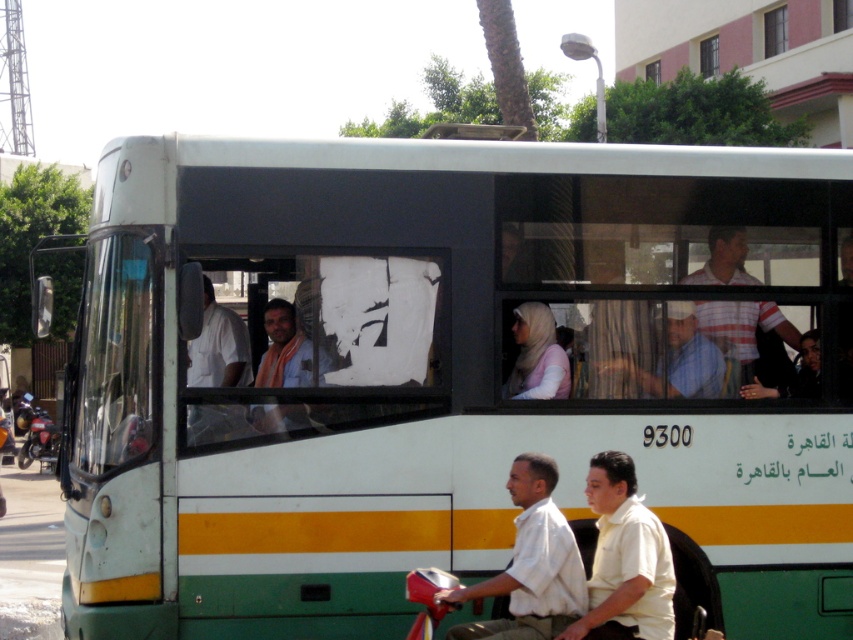
Measure the distance between point (590, 500) and camera.

Point (590, 500) and camera are 5.75 meters apart.

Find the location of a particular element. white matte shirt at center is located at coordinates (624, 560).

Between striped cotton shirt at center and shiny black motorcycle at left, which one appears on the left side from the viewer's perspective?

shiny black motorcycle at left is more to the left.

Describe the element at coordinates (747, 340) in the screenshot. I see `striped cotton shirt at center` at that location.

Image resolution: width=853 pixels, height=640 pixels. I want to click on striped cotton shirt at center, so click(747, 340).

Is white cotton shirt at center smaller than shiny black motorcycle at left?

Incorrect, white cotton shirt at center is not smaller in size than shiny black motorcycle at left.

Which is more to the left, white cotton shirt at center or shiny black motorcycle at left?

From the viewer's perspective, shiny black motorcycle at left appears more on the left side.

Who is more distant from viewer, (546, 609) or (25, 454)?

The point (25, 454) is more distant.

The width and height of the screenshot is (853, 640). Find the location of `white cotton shirt at center`. white cotton shirt at center is located at coordinates (531, 564).